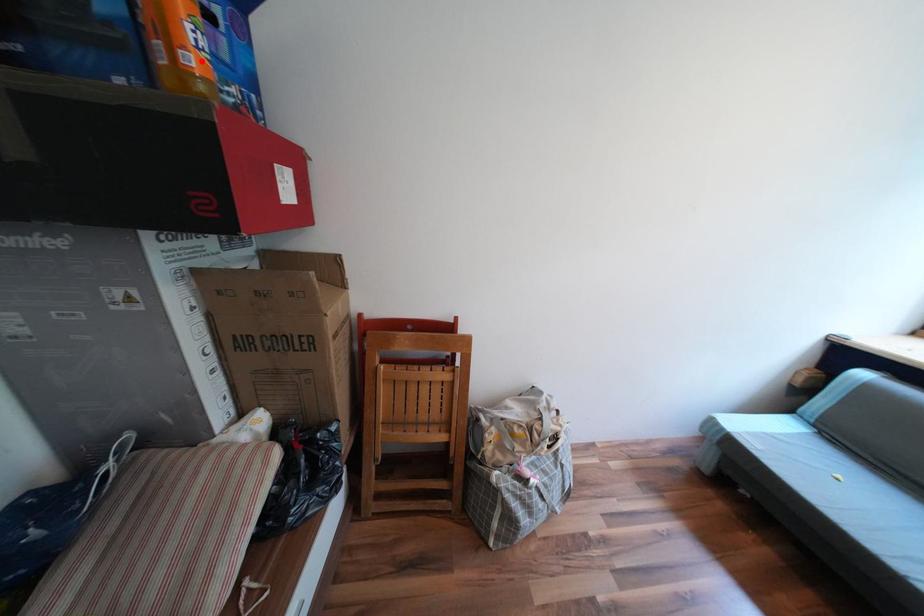
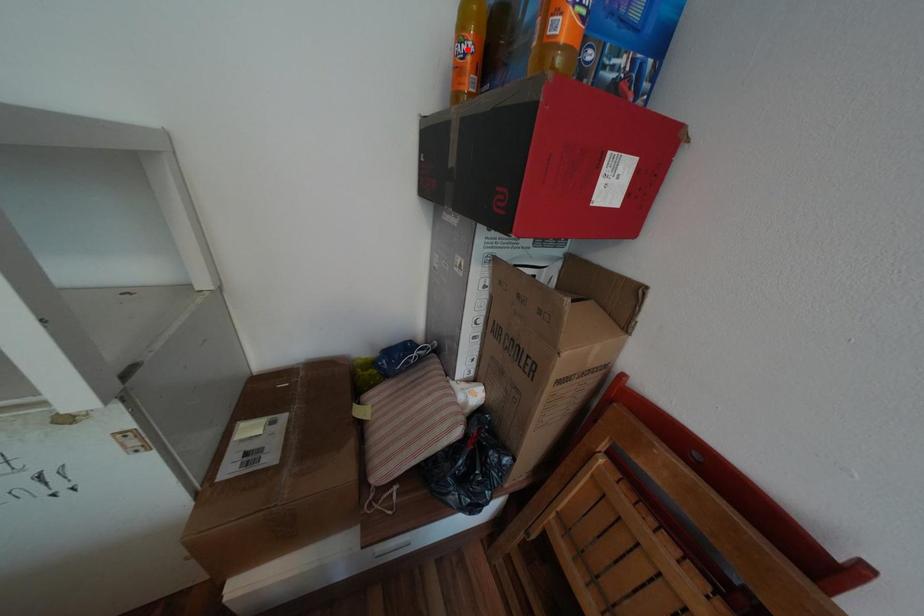
I am providing you with two images of the same scene from different viewpoints. A red point is marked on the first image and another point is marked on the second image. Is the marked point in image1 the same physical position as the marked point in image2?

No